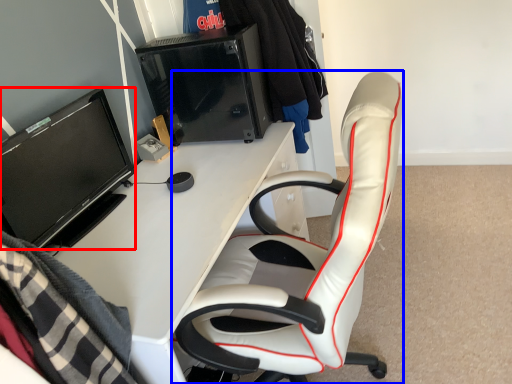
Question: Which point is closer to the camera, television (highlighted by a red box) or chair (highlighted by a blue box)?

Choices:
 (A) television
 (B) chair

Answer: (B)